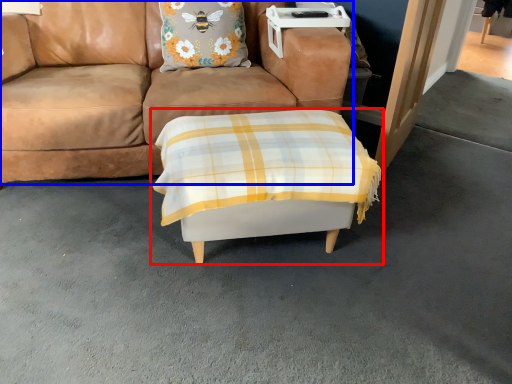
Question: Which point is closer to the camera, table (highlighted by a red box) or studio couch (highlighted by a blue box)?

Choices:
 (A) table
 (B) studio couch

Answer: (A)